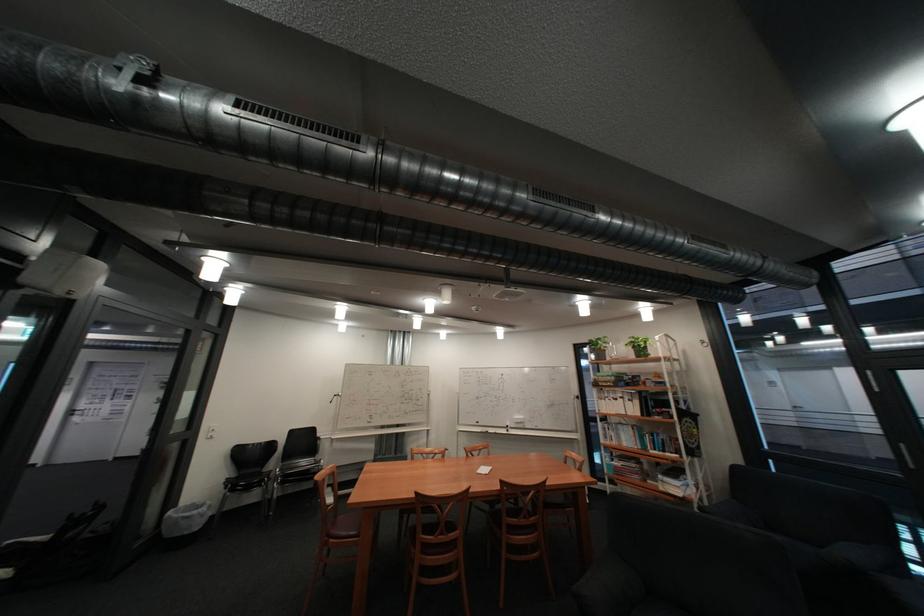
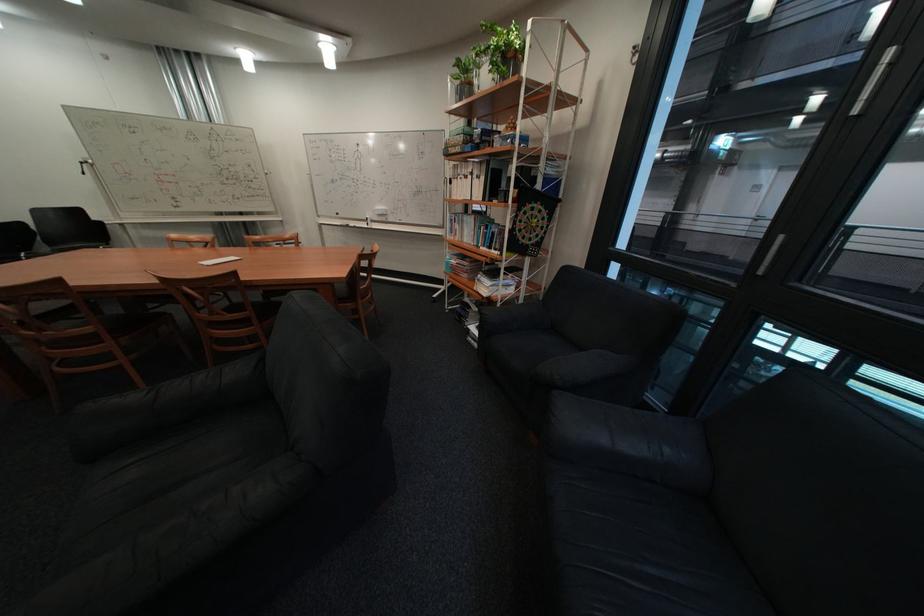
In the second image, find the point that corresponds to (622,399) in the first image.

(475, 177)